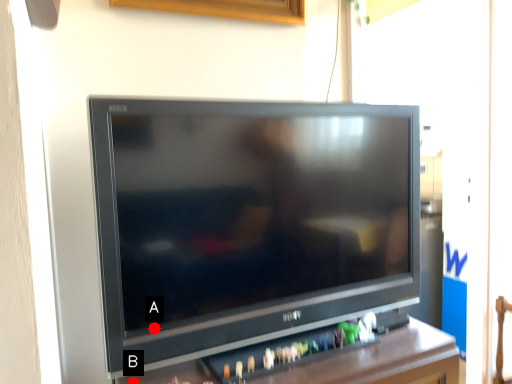
Question: Two points are circled on the image, labeled by A and B beside each circle. Among these points, which one is farthest from the camera?

Choices:
 (A) A is further
 (B) B is further

Answer: (B)